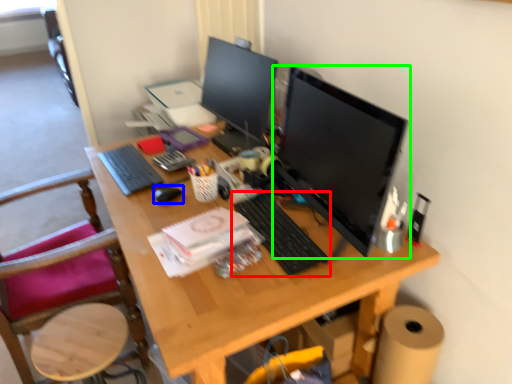
Question: Estimate the real-world distances between objects in this image. Which object is closer to computer keyboard (highlighted by a red box), mouse (highlighted by a blue box) or computer monitor (highlighted by a green box)?

Choices:
 (A) mouse
 (B) computer monitor

Answer: (B)